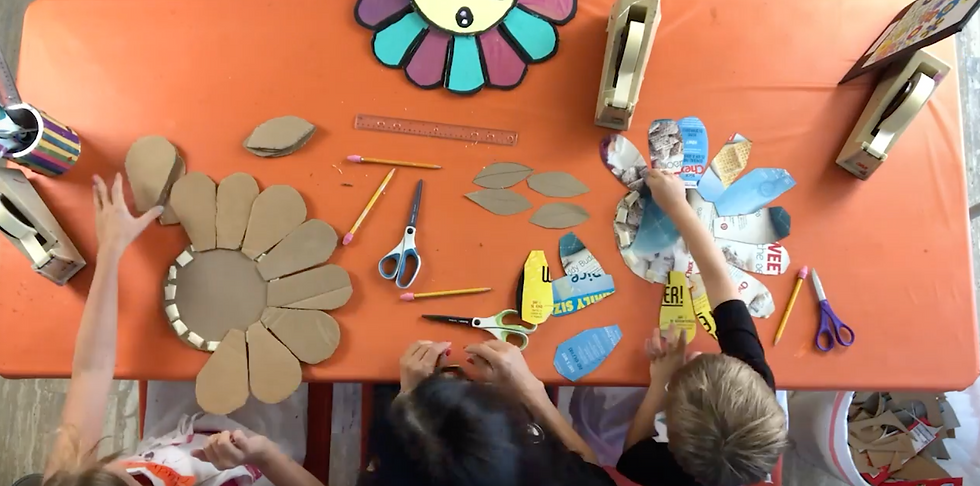
This screenshot has width=980, height=486. What are the coordinates of `tape dispenser` in the screenshot? It's located at (618, 28), (889, 91).